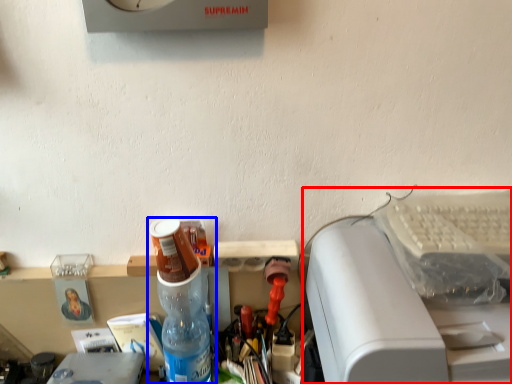
Question: Which point is closer to the camera, printer (highlighted by a red box) or bottle (highlighted by a blue box)?

Choices:
 (A) printer
 (B) bottle

Answer: (A)